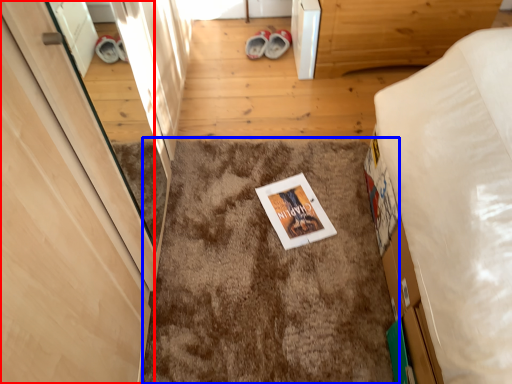
Question: Which object appears closest to the camera in this image, door (highlighted by a red box) or mat (highlighted by a blue box)?

Choices:
 (A) door
 (B) mat

Answer: (A)